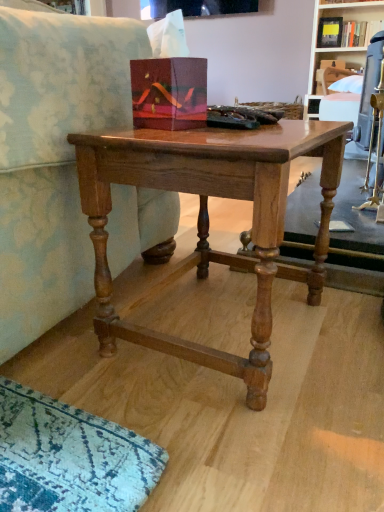
What are the coordinates of `free space in front of shiny brown wood table at center` in the screenshot? It's located at (235, 436).